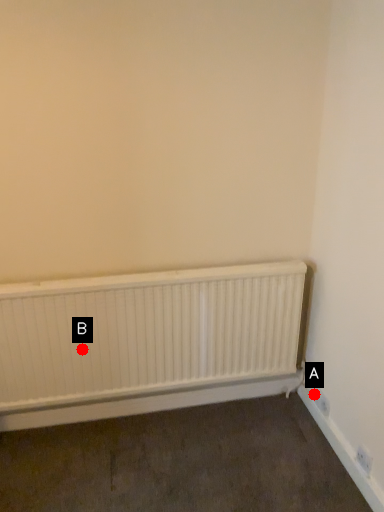
Question: Two points are circled on the image, labeled by A and B beside each circle. Among these points, which one is nearest to the camera?

Choices:
 (A) A is closer
 (B) B is closer

Answer: (B)